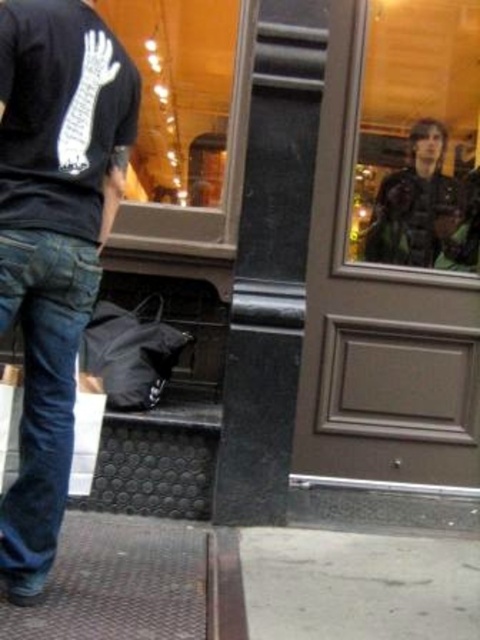
Question: Which point is closer to the camera?

Choices:
 (A) (28, 369)
 (B) (397, 234)

Answer: (A)

Question: Is black matte jeans at lower left thinner than gray concrete pavement at lower center?

Choices:
 (A) no
 (B) yes

Answer: (B)

Question: Can you confirm if gray concrete pavement at lower center is positioned below denim at left?

Choices:
 (A) no
 (B) yes

Answer: (B)

Question: Among these objects, which one is farthest from the camera?

Choices:
 (A) transparent glass door at upper right
 (B) clear glass door at center

Answer: (A)

Question: Is denim at left to the right of clear glass door at center from the viewer's perspective?

Choices:
 (A) no
 (B) yes

Answer: (A)

Question: Estimate the real-world distances between objects in this image. Which object is farther from the dark brown leather jacket at upper right?

Choices:
 (A) denim at left
 (B) clear glass door at center
 (C) gray concrete pavement at lower center

Answer: (A)